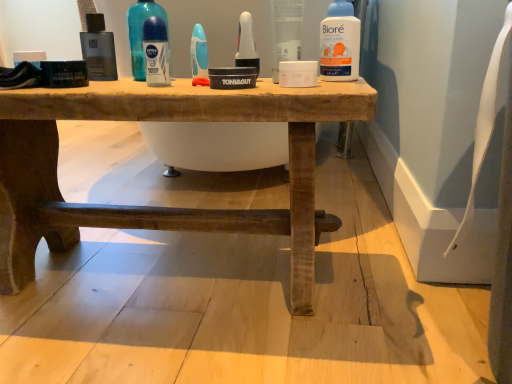
Where is `vacant space in front of blue glossy mouthwash at center, the 3th mouthwash viewed from the left`? This screenshot has height=384, width=512. vacant space in front of blue glossy mouthwash at center, the 3th mouthwash viewed from the left is located at coordinates (176, 84).